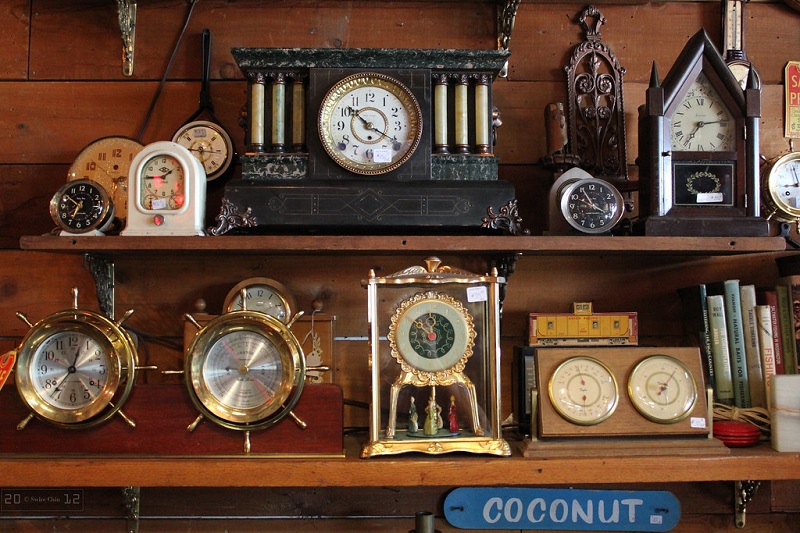
Locate an element on the screen. clocks on top shelf, fully or partially visible is located at coordinates (86, 204), (108, 165), (152, 180), (217, 146), (366, 118), (598, 198), (705, 125), (788, 181).